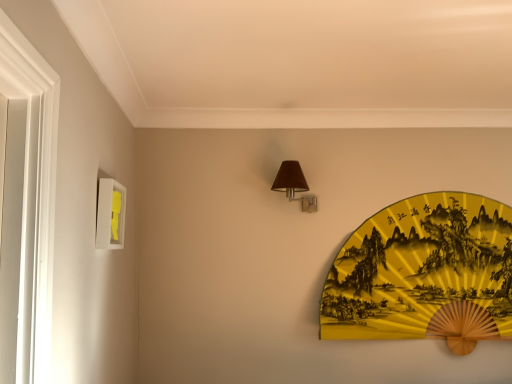
Question: Is matte brown fabric at upper center facing away from white matte picture frame at left?

Choices:
 (A) no
 (B) yes

Answer: (A)

Question: Can you confirm if matte brown fabric at upper center is shorter than white matte picture frame at left?

Choices:
 (A) yes
 (B) no

Answer: (A)

Question: Considering the relative positions of matte brown fabric at upper center and white matte picture frame at left in the image provided, is matte brown fabric at upper center in front of white matte picture frame at left?

Choices:
 (A) no
 (B) yes

Answer: (A)

Question: Is matte brown fabric at upper center not near white matte picture frame at left?

Choices:
 (A) yes
 (B) no

Answer: (B)

Question: Can you confirm if matte brown fabric at upper center is bigger than white matte picture frame at left?

Choices:
 (A) no
 (B) yes

Answer: (B)

Question: Is matte brown fabric at upper center further to the viewer compared to white matte picture frame at left?

Choices:
 (A) no
 (B) yes

Answer: (B)

Question: Does white matte picture frame at left have a smaller size compared to yellow paper fan at upper right?

Choices:
 (A) yes
 (B) no

Answer: (A)

Question: From a real-world perspective, is white matte picture frame at left located higher than yellow paper fan at upper right?

Choices:
 (A) no
 (B) yes

Answer: (B)

Question: Is white matte picture frame at left closer to camera compared to yellow paper fan at upper right?

Choices:
 (A) no
 (B) yes

Answer: (B)

Question: Is white matte picture frame at left completely or partially outside of yellow paper fan at upper right?

Choices:
 (A) yes
 (B) no

Answer: (A)

Question: Is white matte picture frame at left oriented away from yellow paper fan at upper right?

Choices:
 (A) no
 (B) yes

Answer: (A)

Question: Considering the relative sizes of white matte picture frame at left and yellow paper fan at upper right in the image provided, is white matte picture frame at left bigger than yellow paper fan at upper right?

Choices:
 (A) yes
 (B) no

Answer: (B)

Question: Is yellow paper fan at upper right located outside white matte picture frame at left?

Choices:
 (A) no
 (B) yes

Answer: (B)